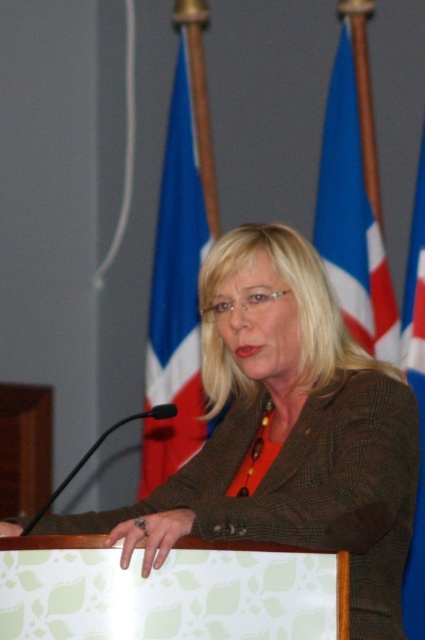
Question: Which object is closer to the camera taking this photo?

Choices:
 (A) blue fabric flag at upper right
 (B) brown textured blazer at center

Answer: (B)

Question: Can you confirm if blue fabric flag at center is bigger than blue fabric flag at upper right?

Choices:
 (A) no
 (B) yes

Answer: (B)

Question: Among these objects, which one is nearest to the camera?

Choices:
 (A) blue fabric flag at center
 (B) blue fabric flag at upper right
 (C) brown textured blazer at center

Answer: (C)

Question: Estimate the real-world distances between objects in this image. Which object is closer to the blue fabric flag at upper right?

Choices:
 (A) blue fabric flag at center
 (B) brown textured blazer at center

Answer: (A)

Question: Is brown textured blazer at center closer to the viewer compared to blue fabric flag at center?

Choices:
 (A) no
 (B) yes

Answer: (B)

Question: Is brown textured blazer at center closer to the viewer compared to blue fabric flag at upper right?

Choices:
 (A) yes
 (B) no

Answer: (A)